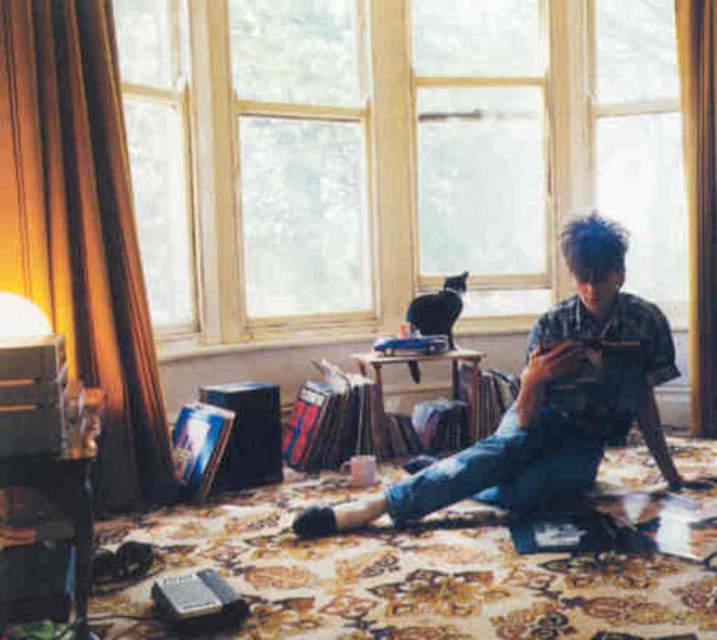
You are a photographer trying to capture the black fur cat at center without including the wooden frame at upper center in the shot. Is this possible based on their current positions?

The wooden frame at upper center is positioned over the black fur cat at center, so it would block the view of the cat. Therefore, it is not possible to take a photo of the black fur cat at center without including the wooden frame at upper center in the shot.

You are standing at point (436, 308) and want to walk to point (523, 452). According to the scene description, which direction should you move in?

You should move forward because point (523, 452) is in front of point (436, 308).